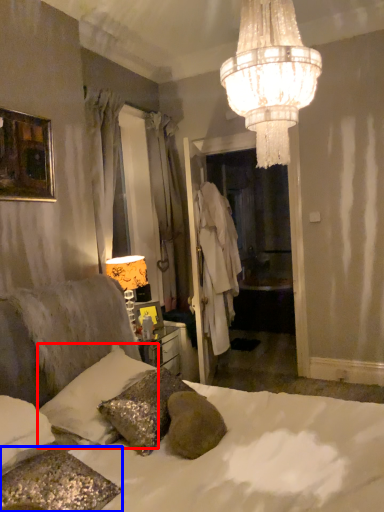
Question: Which object appears farthest to the camera in this image, pillow (highlighted by a red box) or pillow (highlighted by a blue box)?

Choices:
 (A) pillow
 (B) pillow

Answer: (A)